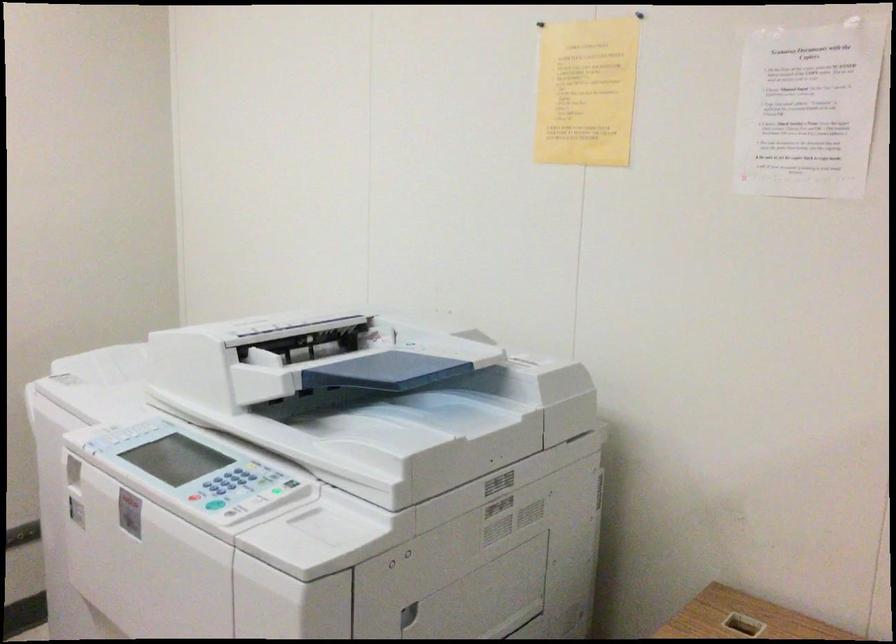
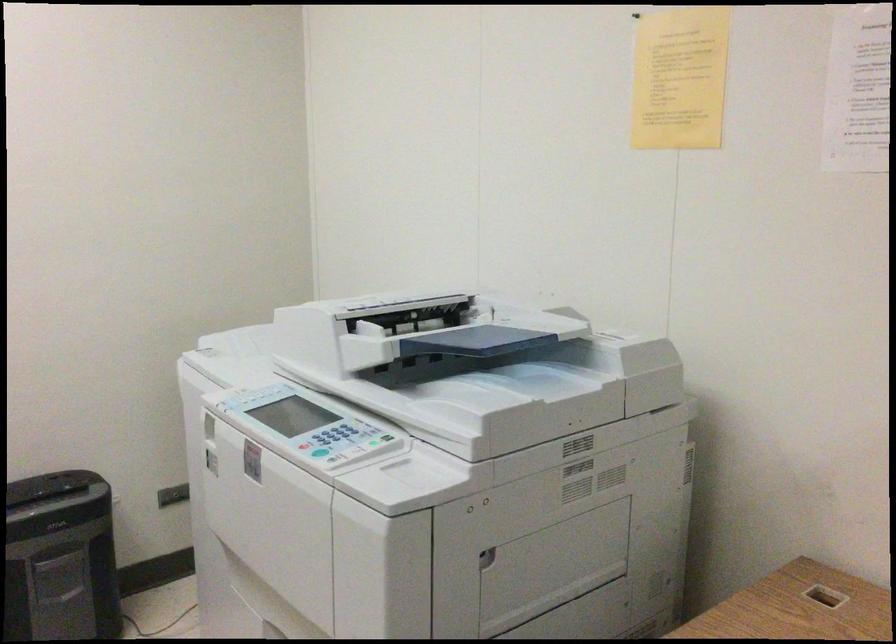
Locate, in the second image, the point that corresponds to the point at 227,485 in the first image.

(332, 438)